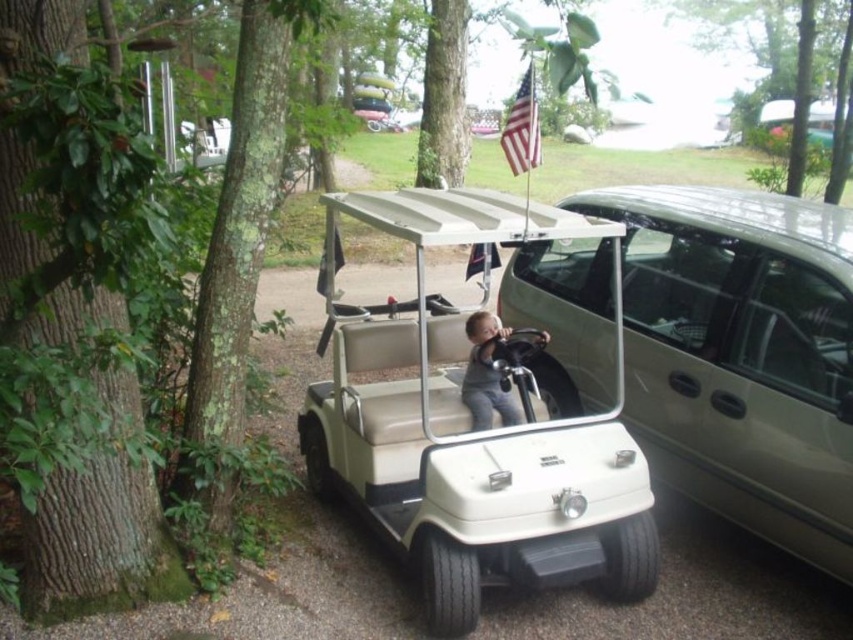
Question: Estimate the real-world distances between objects in this image. Which object is closer to the gray matte shirt at center?

Choices:
 (A) american flag at center
 (B) green leafy tree at left
 (C) american flag at upper center

Answer: (A)

Question: Where is green leafy tree at left located in relation to american flag at upper center in the image?

Choices:
 (A) below
 (B) above

Answer: (A)

Question: Which point is closer to the camera?

Choices:
 (A) (535, 144)
 (B) (79, 36)
 (C) (849, 381)
 (D) (360, 198)

Answer: (B)

Question: Does green leafy tree at left appear on the left side of gray matte shirt at center?

Choices:
 (A) no
 (B) yes

Answer: (B)

Question: Which object is positioned farthest from the american flag at center?

Choices:
 (A) gray matte shirt at center
 (B) beige leather golf cart at center

Answer: (B)

Question: Does beige leather golf cart at center come behind american flag at center?

Choices:
 (A) yes
 (B) no

Answer: (B)